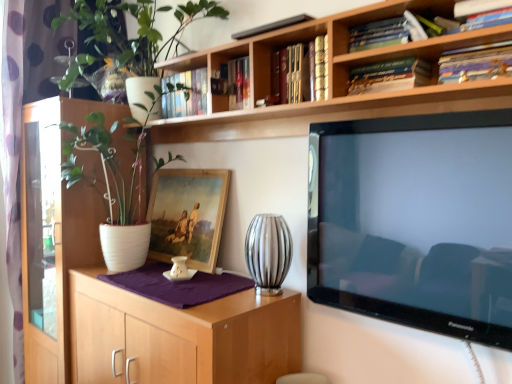
The image size is (512, 384). I want to click on white matte pot at left, so click(x=114, y=189).

What is the approximate width of white matte pot at left?

white matte pot at left is 22.92 inches in width.

I want to click on hardcover book at upper right, marked as the first book in a right-to-left arrangement, so click(x=476, y=63).

At what (x,y) coordinates should I click in order to perform the action: click on wooden cabinet at center. Please return your answer as a coordinate pair (x, y). Looking at the image, I should click on (180, 336).

Describe the element at coordinates (379, 34) in the screenshot. The width and height of the screenshot is (512, 384). I see `hardcover books at upper center, the 3th book viewed from the right` at that location.

Identify the location of hardcover book at upper center, arranged as the 1th book when viewed from the left. (300, 72).

From the image's perspective, is wooden framed painting at center under hardcover book at upper center, which is the 2th book from right to left?

Yes.

Is wooden framed painting at center further to the viewer compared to hardcover book at upper center, which is the 2th book from right to left?

Yes, wooden framed painting at center is further from the viewer.

Consider the image. From a real-world perspective, who is located lower, wooden framed painting at center or hardcover book at upper center, the 3th book from the left?

From a 3D spatial view, wooden framed painting at center is below.

Is wooden framed painting at center next to hardcover book at upper center, the 3th book from the left?

There is a gap between wooden framed painting at center and hardcover book at upper center, the 3th book from the left.

Is wooden bookshelf at upper center smaller than white matte pot at left?

Yes, wooden bookshelf at upper center is smaller than white matte pot at left.

Is wooden bookshelf at upper center in front of or behind white matte pot at left in the image?

Visually, wooden bookshelf at upper center is located in front of white matte pot at left.

Is wooden bookshelf at upper center wider or thinner than white matte pot at left?

wooden bookshelf at upper center is thinner than white matte pot at left.

Is wooden bookshelf at upper center not within white matte pot at left?

Yes.

Who is bigger, wooden bookshelf at upper center or hardcover book at upper right, marked as the first book in a right-to-left arrangement?

With larger size is wooden bookshelf at upper center.

Does wooden bookshelf at upper center appear on the left side of hardcover book at upper right, marked as the first book in a right-to-left arrangement?

Yes, wooden bookshelf at upper center is to the left of hardcover book at upper right, marked as the first book in a right-to-left arrangement.

Looking at their sizes, would you say wooden bookshelf at upper center is wider or thinner than hardcover book at upper right, which is counted as the 4th book, starting from the left?

wooden bookshelf at upper center is wider than hardcover book at upper right, which is counted as the 4th book, starting from the left.

Can you tell me how much wooden bookshelf at upper center and hardcover book at upper right, which is counted as the 4th book, starting from the left, differ in facing direction?

They differ by 0.97 degrees in their facing directions.

Would you say hardcover book at upper center, arranged as the 1th book when viewed from the left, is outside wooden bookshelf at upper center?

Yes, hardcover book at upper center, arranged as the 1th book when viewed from the left, is outside of wooden bookshelf at upper center.

Measure the distance between hardcover book at upper center, the fourth book when ordered from right to left, and wooden bookshelf at upper center.

They are 8.40 inches apart.

In terms of width, does hardcover book at upper center, arranged as the 1th book when viewed from the left, look wider or thinner when compared to wooden bookshelf at upper center?

Considering their sizes, hardcover book at upper center, arranged as the 1th book when viewed from the left, looks slimmer than wooden bookshelf at upper center.

From a real-world perspective, is hardcover book at upper center, the fourth book when ordered from right to left, positioned above or below wooden bookshelf at upper center?

In terms of real-world spatial position, hardcover book at upper center, the fourth book when ordered from right to left, is below wooden bookshelf at upper center.

Is white matte cabinet at left wider than hardcover book at upper right, marked as the first book in a right-to-left arrangement?

Yes, white matte cabinet at left is wider than hardcover book at upper right, marked as the first book in a right-to-left arrangement.

From the picture: Can we say white matte cabinet at left lies outside hardcover book at upper right, marked as the first book in a right-to-left arrangement?

Yes, white matte cabinet at left is outside of hardcover book at upper right, marked as the first book in a right-to-left arrangement.

How far apart are white matte cabinet at left and hardcover book at upper right, which is counted as the 4th book, starting from the left?

They are 5.74 feet apart.

Are white matte pot at left and hardcover book at upper center, arranged as the 1th book when viewed from the left, located far from each other?

No, white matte pot at left is in close proximity to hardcover book at upper center, arranged as the 1th book when viewed from the left.

Consider the image. Between white matte pot at left and hardcover book at upper center, the fourth book when ordered from right to left, which one has smaller size?

With smaller size is hardcover book at upper center, the fourth book when ordered from right to left.

Considering the sizes of objects white matte pot at left and hardcover book at upper center, the fourth book when ordered from right to left, in the image provided, who is wider, white matte pot at left or hardcover book at upper center, the fourth book when ordered from right to left,?

Wider between the two is white matte pot at left.

Is hardcover book at upper center, the fourth book when ordered from right to left, surrounded by white matte pot at left?

No, hardcover book at upper center, the fourth book when ordered from right to left, is not inside white matte pot at left.

In the image, is wooden bookshelf at upper center positioned in front of or behind white matte pot at left?

wooden bookshelf at upper center is positioned farther from the viewer than white matte pot at left.

You are a GUI agent. You are given a task and a screenshot of the screen. Output one action in this format:
    pyautogui.click(x=<x>, y=<y>)
    Task: Click on the houseplant located in front of the wooden bookshelf at upper center
    This screenshot has height=384, width=512.
    Given the screenshot: What is the action you would take?
    pyautogui.click(x=114, y=189)

Is wooden bookshelf at upper center far away from white matte pot at left?

No, wooden bookshelf at upper center is not far from white matte pot at left.

Between wooden bookshelf at upper center and white matte pot at left, which one has less height?

Standing shorter between the two is wooden bookshelf at upper center.

The width and height of the screenshot is (512, 384). What are the coordinates of `the 3rd book counting from the right of the wooden framed painting at center` in the screenshot? It's located at (389, 76).

Where is `bookcase in front of the white matte pot at left`? The image size is (512, 384). bookcase in front of the white matte pot at left is located at coordinates (337, 62).

Looking at this image, considering their positions, is wooden framed painting at center positioned further to silver metallic vase at center than hardcover book at upper right, marked as the first book in a right-to-left arrangement?

hardcover book at upper right, marked as the first book in a right-to-left arrangement.

From the image, which object appears to be nearer to wooden cabinet at center, hardcover book at upper right, marked as the first book in a right-to-left arrangement, or white matte cabinet at left?

white matte cabinet at left lies closer to wooden cabinet at center than the other object.

Looking at the image, which one is located further to white matte pot at upper left, white matte pot at left or wooden bookshelf at upper center?

The object further to white matte pot at upper left is white matte pot at left.

Based on their spatial positions, is silver metallic vase at center or hardcover books at upper center, which appears as the 2th book when viewed from the left, closer to wooden cabinet at center?

silver metallic vase at center.

Which object lies further to the anchor point white matte pot at upper left, silver metallic vase at center or white matte pot at left?

Among the two, silver metallic vase at center is located further to white matte pot at upper left.

Looking at this image, looking at the image, which one is located further to hardcover book at upper right, which is counted as the 4th book, starting from the left, wooden cabinet at center or hardcover book at upper center, arranged as the 1th book when viewed from the left?

wooden cabinet at center.

Estimate the real-world distances between objects in this image. Which object is further from wooden bookshelf at upper center, wooden bookshelf at upper center or silver metallic vase at center?

Based on the image, silver metallic vase at center appears to be further to wooden bookshelf at upper center.

From the image, which object appears to be farther from wooden bookshelf at upper center, wooden bookshelf at upper center or silver metallic vase at center?

silver metallic vase at center.

This screenshot has width=512, height=384. In order to click on picture frame between hardcover book at upper center, arranged as the 1th book when viewed from the left, and silver metallic vase at center, in the vertical direction in this screenshot , I will do `click(188, 215)`.

This screenshot has height=384, width=512. I want to click on bookcase between white matte cabinet at left and hardcover book at upper center, which is the 2th book from right to left, from left to right, so click(337, 62).

Image resolution: width=512 pixels, height=384 pixels. I want to click on shelf between hardcover books at upper center, which appears as the 2th book when viewed from the left, and silver metallic vase at center vertically, so click(220, 74).

Identify the location of picture frame positioned between wooden cabinet at center and white matte cabinet at left from near to far. This screenshot has width=512, height=384. (188, 215).